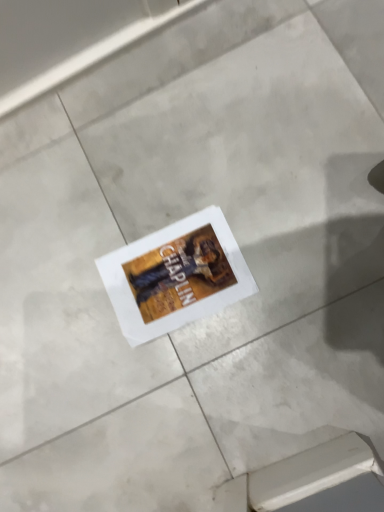
Find the location of a particular element. vacant area on top of white paper magazine at center (from a real-world perspective) is located at coordinates (175, 264).